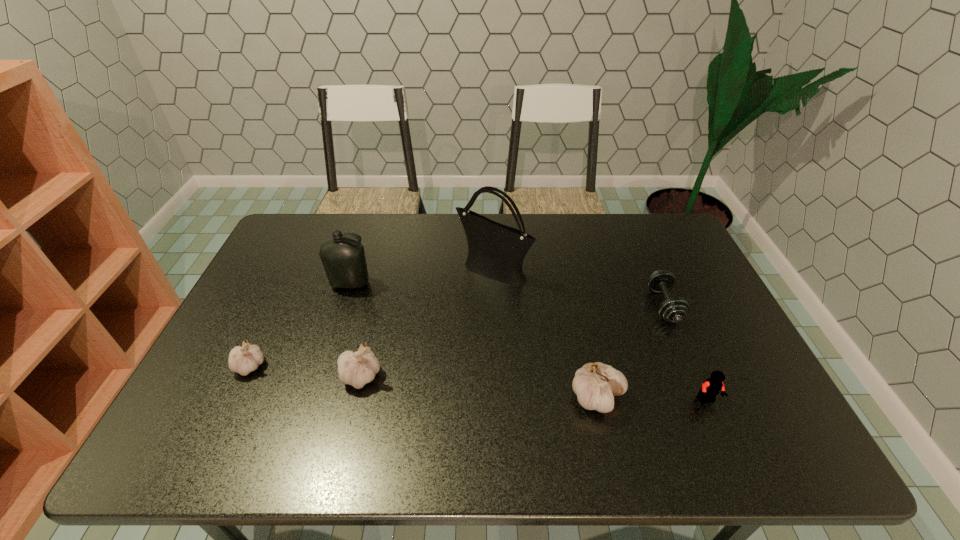
In order to click on free spot between the second tallest object and the fifth shortest object in this screenshot , I will do `click(473, 341)`.

Where is `vacant area that lies between the shoulder bag and the leftmost garlic`? vacant area that lies between the shoulder bag and the leftmost garlic is located at coordinates (372, 319).

Where is `vacant space in between the leftmost object and the dumbbell`? vacant space in between the leftmost object and the dumbbell is located at coordinates (457, 336).

Identify the location of vacant area that lies between the tallest garlic and the shortest garlic. This screenshot has height=540, width=960. (423, 382).

You are a GUI agent. You are given a task and a screenshot of the screen. Output one action in this format:
    pyautogui.click(x=<x>, y=<y>)
    Task: Click on the free area in between the shortest object and the bottle
    The width and height of the screenshot is (960, 540).
    Given the screenshot: What is the action you would take?
    pyautogui.click(x=507, y=295)

Where is `free space that is in between the second tallest garlic and the shortest garlic`? free space that is in between the second tallest garlic and the shortest garlic is located at coordinates pyautogui.click(x=305, y=371).

You are a GUI agent. You are given a task and a screenshot of the screen. Output one action in this format:
    pyautogui.click(x=<x>, y=<y>)
    Task: Click on the vacant area that lies between the dumbbell and the fifth object from left to right
    The width and height of the screenshot is (960, 540).
    Given the screenshot: What is the action you would take?
    pyautogui.click(x=631, y=352)

I want to click on free space between the bottle and the second shortest garlic, so click(355, 330).

This screenshot has height=540, width=960. In order to click on empty space between the tallest garlic and the Lego in this screenshot , I will do `click(652, 399)`.

Where is `object identified as the closest to the second garlic from left to right`? Image resolution: width=960 pixels, height=540 pixels. object identified as the closest to the second garlic from left to right is located at coordinates (243, 360).